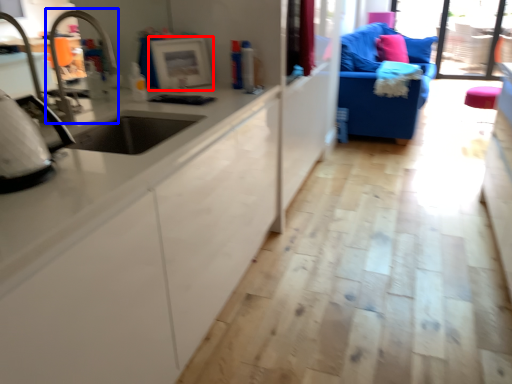
Question: Which object is closer to the camera taking this photo, appliance (highlighted by a red box) or faucet (highlighted by a blue box)?

Choices:
 (A) appliance
 (B) faucet

Answer: (B)